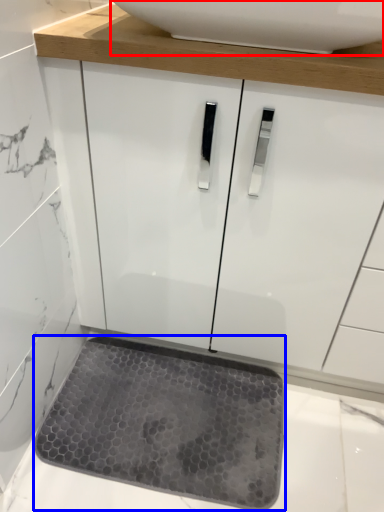
Question: Which object is closer to the camera taking this photo, sink (highlighted by a red box) or mat (highlighted by a blue box)?

Choices:
 (A) sink
 (B) mat

Answer: (A)